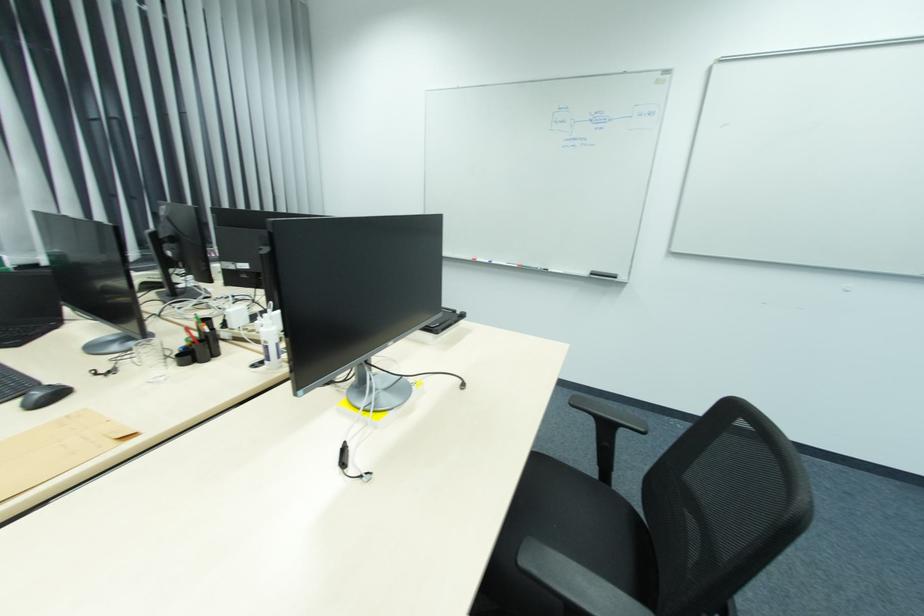
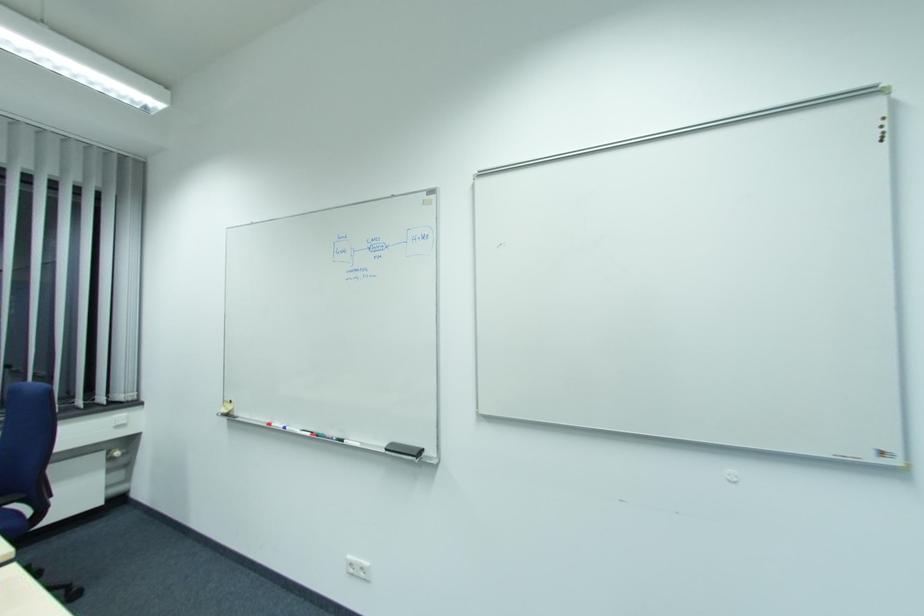
The point at (592, 272) is marked in the first image. Where is the corresponding point in the second image?

(392, 444)